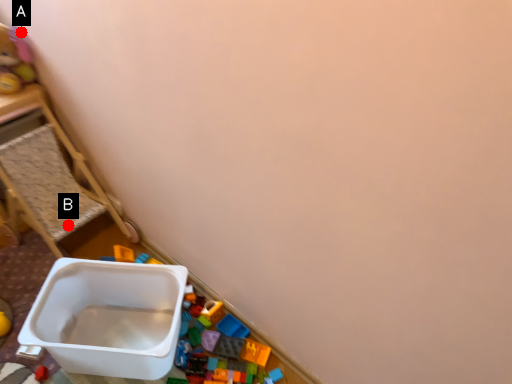
Question: Two points are circled on the image, labeled by A and B beside each circle. Which point is closer to the camera?

Choices:
 (A) A is closer
 (B) B is closer

Answer: (A)